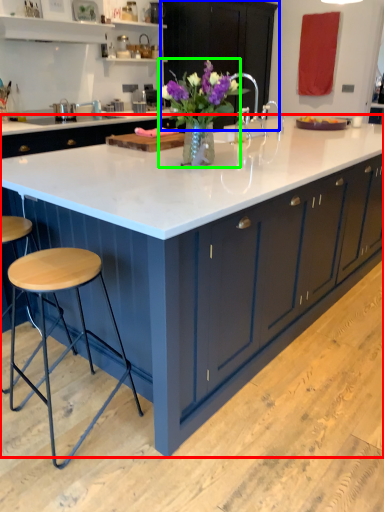
Question: Based on their relative distances, which object is farther from countertop (highlighted by a red box)? Choose from cabinetry (highlighted by a blue box) and floral arrangement (highlighted by a green box).

Choices:
 (A) cabinetry
 (B) floral arrangement

Answer: (A)